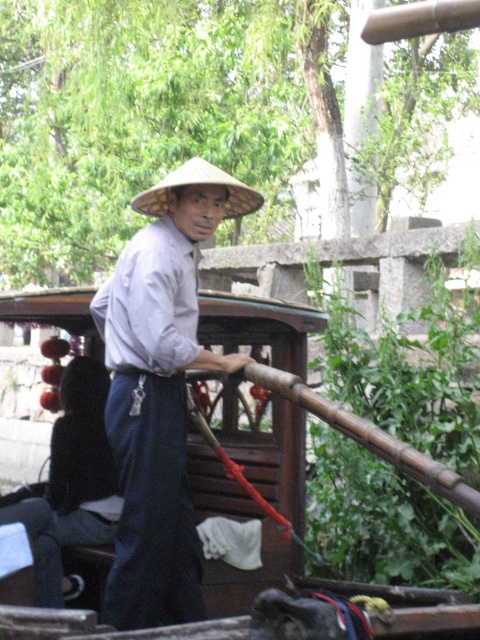
Question: Is light gray cotton shirt at center smaller than natural straw hat at center?

Choices:
 (A) yes
 (B) no

Answer: (B)

Question: Is wooden boat at center wider than natural straw hat at center?

Choices:
 (A) yes
 (B) no

Answer: (A)

Question: Considering the real-world distances, which object is closest to the light gray cotton shirt at center?

Choices:
 (A) wooden boat at center
 (B) natural straw hat at center

Answer: (A)

Question: Which of the following is the closest to the observer?

Choices:
 (A) light gray cotton shirt at center
 (B) natural straw hat at center

Answer: (A)

Question: Does light gray cotton shirt at center have a lesser width compared to wooden boat at center?

Choices:
 (A) no
 (B) yes

Answer: (B)

Question: Which of the following is the farthest from the observer?

Choices:
 (A) natural straw hat at center
 (B) light gray cotton shirt at center
 (C) wooden boat at center

Answer: (A)